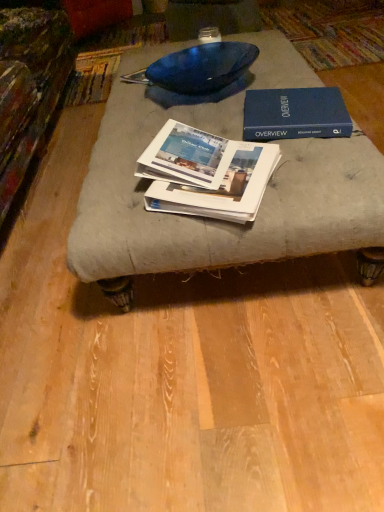
Question: Is white glossy book at center, marked as the third book in a top-to-bottom arrangement, placed right next to blue hardcover book at upper right, the 3th book in the bottom-to-top sequence?

Choices:
 (A) yes
 (B) no

Answer: (B)

Question: From the image's perspective, is white glossy book at center, the 1th book ordered from the bottom, over blue hardcover book at upper right, the 3th book in the bottom-to-top sequence?

Choices:
 (A) yes
 (B) no

Answer: (B)

Question: Is white glossy book at center, marked as the third book in a top-to-bottom arrangement, shorter than blue hardcover book at upper right, the 3th book in the bottom-to-top sequence?

Choices:
 (A) yes
 (B) no

Answer: (A)

Question: Is white glossy book at center, the 1th book ordered from the bottom, turned away from blue hardcover book at upper right, the 3th book in the bottom-to-top sequence?

Choices:
 (A) no
 (B) yes

Answer: (A)

Question: From a real-world perspective, is white glossy book at center, the 1th book ordered from the bottom, physically above blue hardcover book at upper right, which is counted as the first book, starting from the top?

Choices:
 (A) yes
 (B) no

Answer: (B)

Question: Considering the relative sizes of white glossy book at center, marked as the third book in a top-to-bottom arrangement, and blue hardcover book at upper right, which is counted as the first book, starting from the top, in the image provided, is white glossy book at center, marked as the third book in a top-to-bottom arrangement, thinner than blue hardcover book at upper right, which is counted as the first book, starting from the top,?

Choices:
 (A) no
 (B) yes

Answer: (A)

Question: Is blue hardcover book at upper right, the 3th book in the bottom-to-top sequence, oriented towards white glossy book at center, marked as the third book in a top-to-bottom arrangement?

Choices:
 (A) no
 (B) yes

Answer: (A)

Question: From the image's perspective, is blue hardcover book at upper right, which is counted as the first book, starting from the top, located beneath white glossy book at center, the 1th book ordered from the bottom?

Choices:
 (A) no
 (B) yes

Answer: (A)

Question: Does blue hardcover book at upper right, which is counted as the first book, starting from the top, have a lesser height compared to white glossy book at center, the 1th book ordered from the bottom?

Choices:
 (A) no
 (B) yes

Answer: (A)

Question: Considering the relative sizes of blue hardcover book at upper right, the 3th book in the bottom-to-top sequence, and white glossy book at center, marked as the third book in a top-to-bottom arrangement, in the image provided, is blue hardcover book at upper right, the 3th book in the bottom-to-top sequence, bigger than white glossy book at center, marked as the third book in a top-to-bottom arrangement,?

Choices:
 (A) no
 (B) yes

Answer: (B)

Question: Is blue hardcover book at upper right, the 3th book in the bottom-to-top sequence, touching white glossy book at center, marked as the third book in a top-to-bottom arrangement?

Choices:
 (A) yes
 (B) no

Answer: (B)

Question: From a real-world perspective, is blue hardcover book at upper right, which is counted as the first book, starting from the top, beneath white glossy book at center, the 1th book ordered from the bottom?

Choices:
 (A) yes
 (B) no

Answer: (B)

Question: Can you confirm if white paper booklet at center, which is the second book in top-to-bottom order, is bigger than white glossy book at center, marked as the third book in a top-to-bottom arrangement?

Choices:
 (A) no
 (B) yes

Answer: (A)